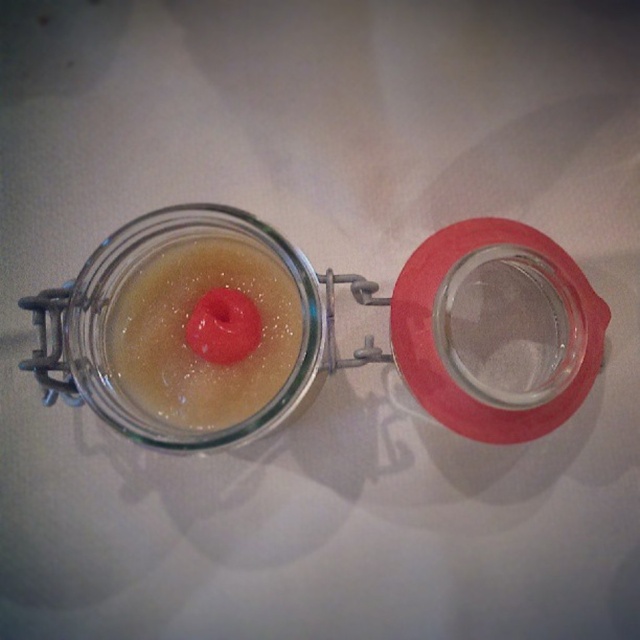
You are trying to determine if the translucent gelatinous substance at center will overflow when you add more liquid. Based on the image, can you tell if there is enough space left in the transparent glass jar at upper center?

The translucent gelatinous substance at center is not as tall as the transparent glass jar at upper center, which means there is still space in the jar to add more liquid without causing an overflow.

You are looking at the jar and want to place a sticker on the point that is closer to you. Which point should you choose between point (250, 358) and point (80, 298)?

Point (80, 298) is closer to you than point (250, 358), so you should place the sticker on point (80, 298).